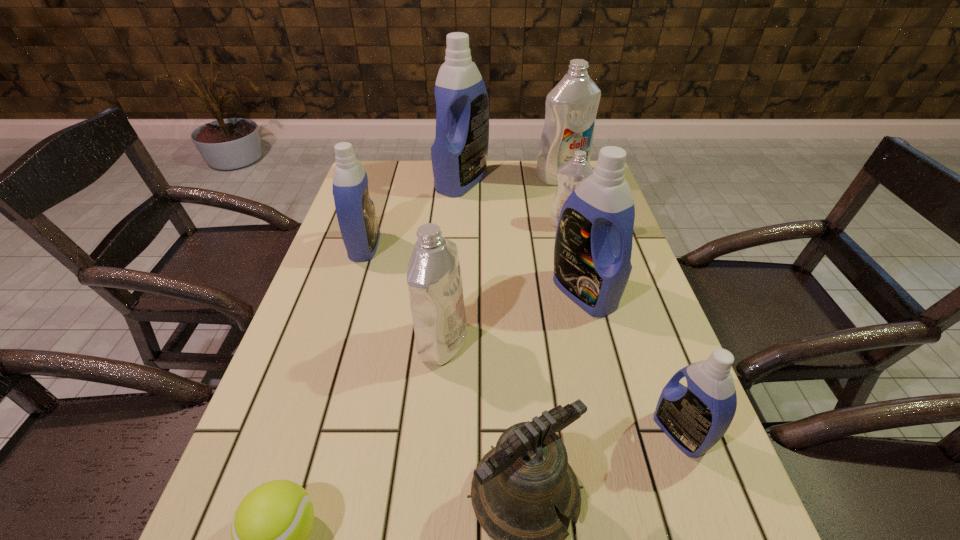
Image resolution: width=960 pixels, height=540 pixels. What are the coordinates of `blank region between the leftmost detergent and the smallest white detergent` in the screenshot? It's located at (467, 235).

Identify the location of the third closest object to the nearest white detergent. (356, 215).

Where is `object that is the eighth closest one to the leftmost white detergent`? object that is the eighth closest one to the leftmost white detergent is located at coordinates 571,106.

You are a GUI agent. You are given a task and a screenshot of the screen. Output one action in this format:
    pyautogui.click(x=<x>, y=<y>)
    Task: Click on the detergent object that ranks as the fourth closest to the nearest blue detergent
    
    Given the screenshot: What is the action you would take?
    pyautogui.click(x=356, y=215)

I want to click on detergent that stands as the fourth closest to the second farthest white detergent, so coord(434,279).

Locate which blue detergent is the closest to the leftmost detergent. Please provide its 2D coordinates. Your answer should be formatted as a tuple, i.e. [(x, y)], where the tuple contains the x and y coordinates of a point satisfying the conditions above.

[(459, 154)]

Locate an element on the screen. The height and width of the screenshot is (540, 960). blue detergent that is the closest to the second farthest blue detergent is located at coordinates (459, 154).

Select which white detergent appears as the closest to the smallest white detergent. Please provide its 2D coordinates. Your answer should be formatted as a tuple, i.e. [(x, y)], where the tuple contains the x and y coordinates of a point satisfying the conditions above.

[(571, 106)]

Image resolution: width=960 pixels, height=540 pixels. I want to click on the second closest white detergent relative to the nearest detergent, so click(572, 173).

Find the location of `vacant space that satisfies the following two spatial constraints: 1. on the back side of the third farthest blue detergent; 2. on the right side of the second farthest white detergent`. vacant space that satisfies the following two spatial constraints: 1. on the back side of the third farthest blue detergent; 2. on the right side of the second farthest white detergent is located at coordinates (566, 224).